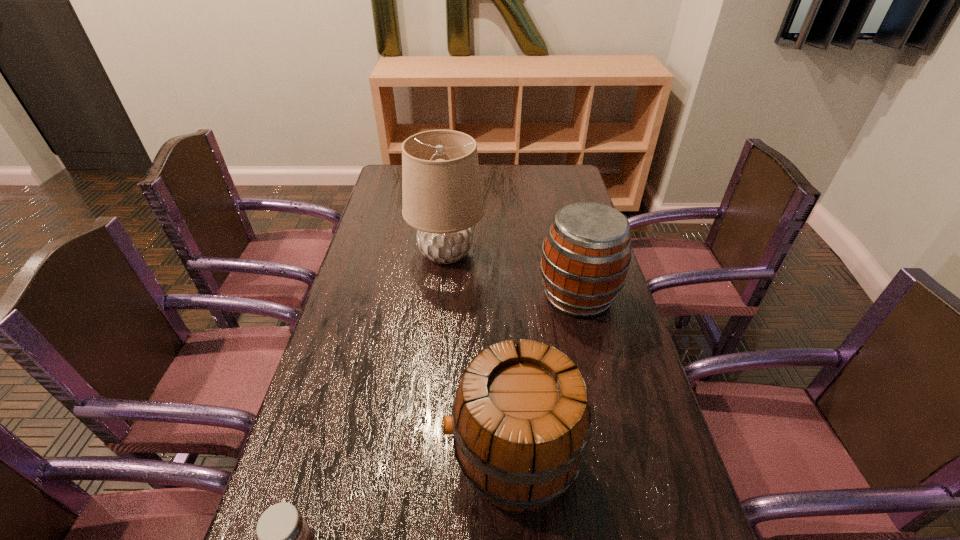
You are a GUI agent. You are given a task and a screenshot of the screen. Output one action in this format:
    pyautogui.click(x=<x>, y=<y>)
    Task: Click on the lampshade
    
    Given the screenshot: What is the action you would take?
    pyautogui.click(x=442, y=198)

Find the location of a particular element. The width and height of the screenshot is (960, 540). the farther cider is located at coordinates click(586, 255).

Locate an element on the screen. Image resolution: width=960 pixels, height=540 pixels. the nearer cider is located at coordinates (521, 422).

Where is `free spot located on the left of the lampshade`? free spot located on the left of the lampshade is located at coordinates (381, 253).

Identify the location of vacant area situated 0.190m on the front of the farther cider. This screenshot has width=960, height=540. (599, 383).

This screenshot has width=960, height=540. What are the coordinates of `vacant space situated on the side of the nearer cider where the spigot is located` in the screenshot? It's located at (381, 458).

The height and width of the screenshot is (540, 960). Identify the location of free point located on the side of the nearer cider where the spigot is located. (353, 458).

At what (x,y) coordinates should I click in order to perform the action: click on vacant region located 0.280m on the side of the nearer cider where the spigot is located. Please return your answer as a coordinate pair (x, y). The width and height of the screenshot is (960, 540). Looking at the image, I should click on (316, 458).

Locate an element on the screen. object that is at the right edge is located at coordinates (586, 255).

The height and width of the screenshot is (540, 960). I want to click on free space at the far edge, so click(x=515, y=176).